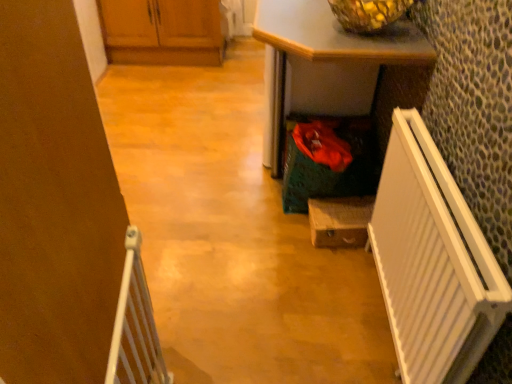
Locate an element on the screen. free spot to the left of wooden drawer at center, which appears as the 2th cabinetry when viewed from the top is located at coordinates (280, 233).